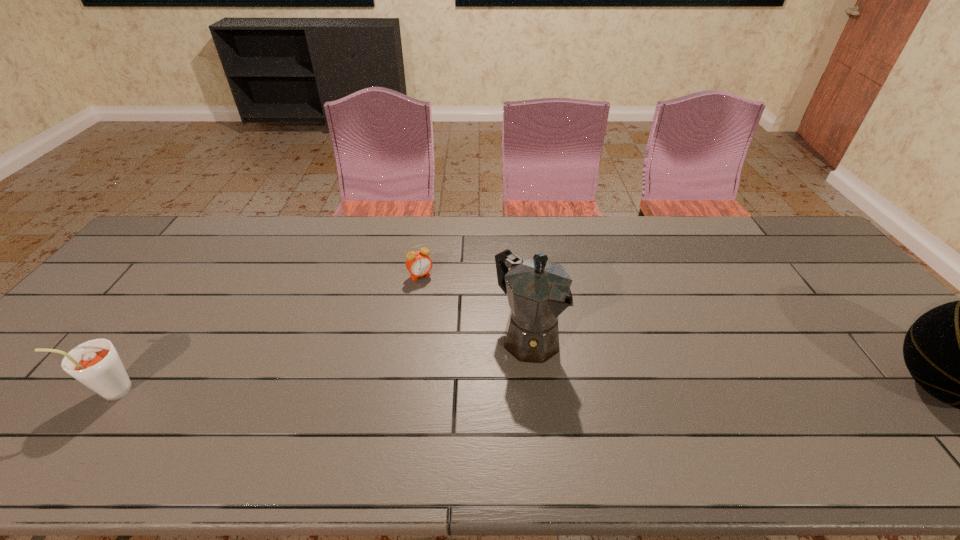
This screenshot has width=960, height=540. Find the location of `free space on the desktop that is between the root beer and the basketball and is positioned on the face of the farthest object`. free space on the desktop that is between the root beer and the basketball and is positioned on the face of the farthest object is located at coordinates (500, 390).

Where is `vacant space on the desktop that is between the second shortest object and the basketball and is positioned on the pouring side of the third object from left to right`? vacant space on the desktop that is between the second shortest object and the basketball and is positioned on the pouring side of the third object from left to right is located at coordinates (591, 390).